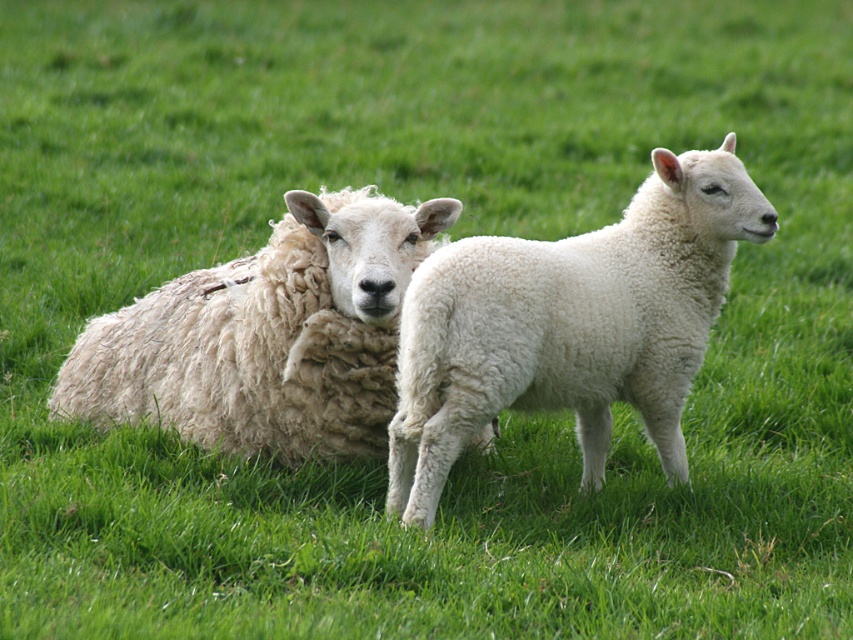
You are a photographer trying to capture both the white fluffy lamb at center and the white woolen sheep at center in a single shot. Since they are positioned at different heights, which one would appear lower in your photo?

The white fluffy lamb at center appears lower in the photo because it is positioned below the white woolen sheep at center.

In the scene shown: You are a farmer checking the field. You see the white fluffy lamb at center and the white woolen sheep at center. Which one takes up more space in the image?

The white woolen sheep at center takes up more space than the white fluffy lamb at center because the lamb occupies less space.

You are standing in a grassy field with two sheep. You notice two points in the scene labeled as point 1 and point 2. Point 1 is at coordinate (596, 346) and point 2 is at coordinate (183, 275). Based on your observation, which point is closer to you?

Point 1 is closer to the camera than point 2.